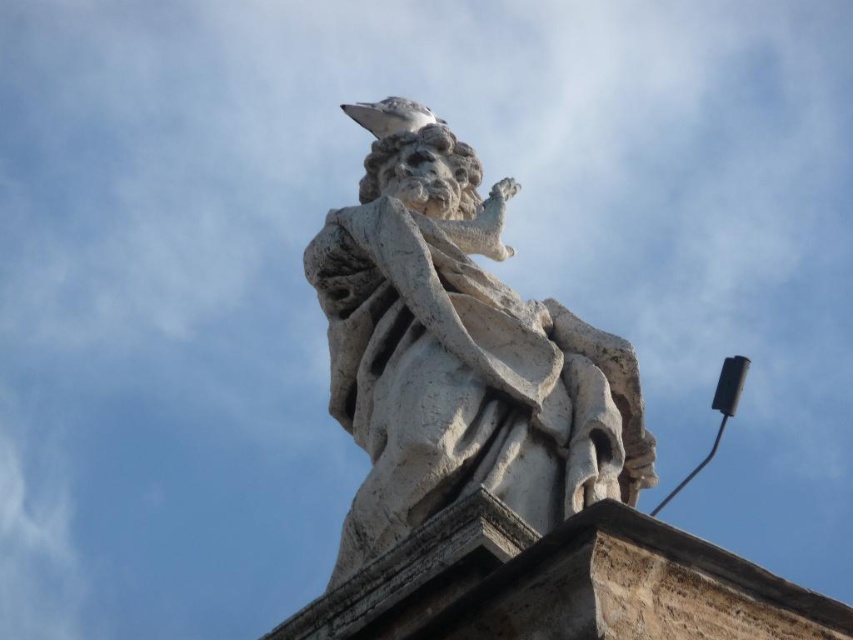
Is white stone statue at center to the left of white matte pigeon at upper center from the viewer's perspective?

A: In fact, white stone statue at center is to the right of white matte pigeon at upper center.

Based on the photo, is white stone statue at center to the right of white matte pigeon at upper center from the viewer's perspective?

Indeed, white stone statue at center is positioned on the right side of white matte pigeon at upper center.

Is point (622, 435) in front of point (373, 106)?

Yes, it is.

Find the location of a particular element. white stone statue at center is located at coordinates (460, 358).